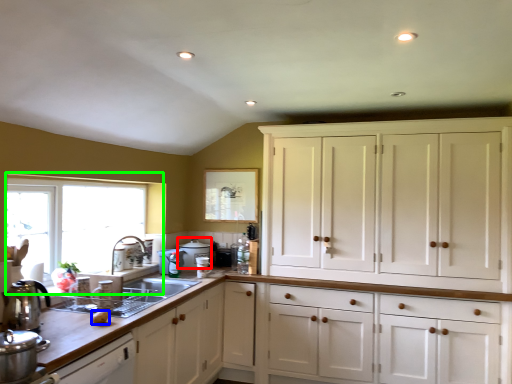
Question: Based on their relative distances, which object is nearer to appliance (highlighted by a red box)? Choose from food (highlighted by a blue box) and window (highlighted by a green box).

Choices:
 (A) food
 (B) window

Answer: (B)